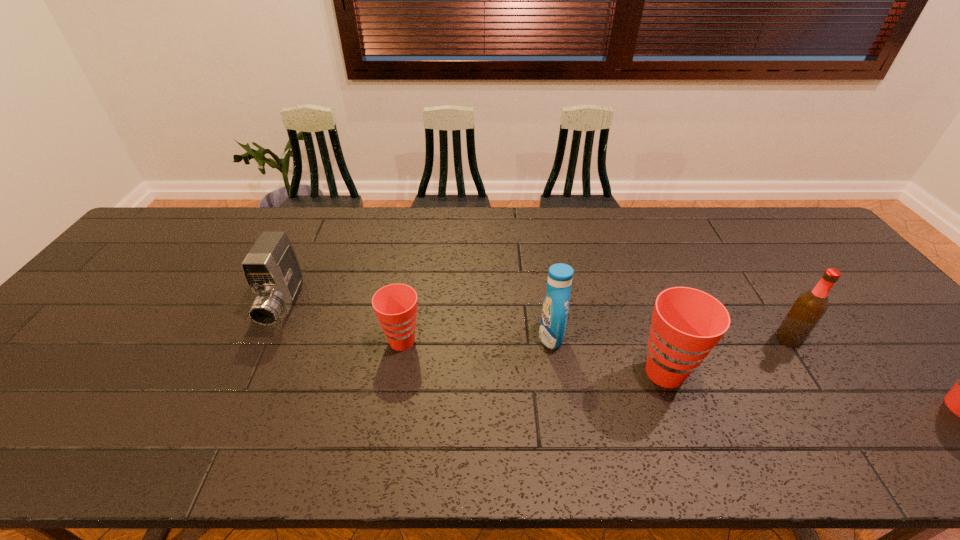
This screenshot has height=540, width=960. I want to click on free space located 0.230m on the front-facing side of the third object from right to left, so click(449, 336).

At what (x,y) coordinates should I click in order to perform the action: click on free region located 0.290m on the front-facing side of the third object from right to left. Please return your answer as a coordinate pair (x, y). Looking at the image, I should click on [426, 336].

At what (x,y) coordinates should I click in order to perform the action: click on free space located 0.350m on the front-facing side of the third object from right to left. Please return your answer as a coordinate pair (x, y). Image resolution: width=960 pixels, height=540 pixels. Looking at the image, I should click on (402, 336).

This screenshot has height=540, width=960. I want to click on vacant space located at the front of the camcorder, highlighting the lens, so click(x=233, y=416).

Locate an element on the screen. The image size is (960, 540). object at the near edge is located at coordinates (687, 323).

In the image, there is a desktop. Where is `vacant space at the far edge`? vacant space at the far edge is located at coordinates (393, 246).

I want to click on vacant space at the near edge of the desktop, so click(x=455, y=391).

Identify the location of vacant space at the left edge of the desktop. The image size is (960, 540). (130, 316).

This screenshot has height=540, width=960. In the image, there is a desktop. Identify the location of vacant space at the right edge. (868, 340).

Image resolution: width=960 pixels, height=540 pixels. Identify the location of vacant space at the far right corner of the desktop. (806, 235).